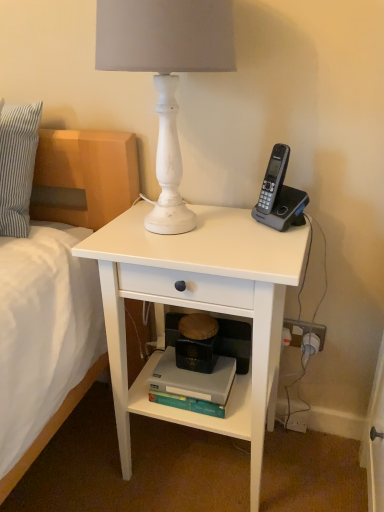
Question: Considering their positions, is gray plastic phone at upper right located in front of or behind hardcover book at lower center?

Choices:
 (A) behind
 (B) front

Answer: (B)

Question: Looking at their shapes, would you say gray plastic phone at upper right is wider or thinner than hardcover book at lower center?

Choices:
 (A) thin
 (B) wide

Answer: (A)

Question: Considering the real-world distances, which object is closest to the white striped pillow at left?

Choices:
 (A) white matte desk at center
 (B) hardcover book at lower center
 (C) white plastic power outlet at lower right
 (D) gray plastic phone at upper right
 (E) white matte lamp at upper center

Answer: (E)

Question: Estimate the real-world distances between objects in this image. Which object is closer to the hardcover book at lower center?

Choices:
 (A) gray plastic phone at upper right
 (B) white matte lamp at upper center
 (C) white striped pillow at left
 (D) white plastic power outlet at lower right
 (E) white matte desk at center

Answer: (E)